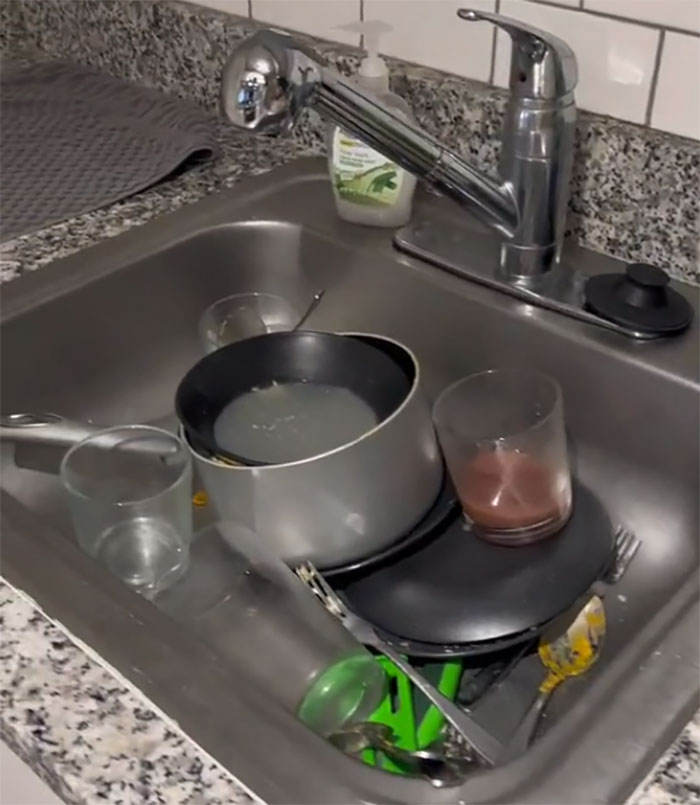
You are a GUI agent. You are given a task and a screenshot of the screen. Output one action in this format:
    pyautogui.click(x=<x>, y=<y>)
    Task: Click on the spoon
    This screenshot has height=805, width=700.
    Given the screenshot: What is the action you would take?
    pyautogui.click(x=314, y=303)